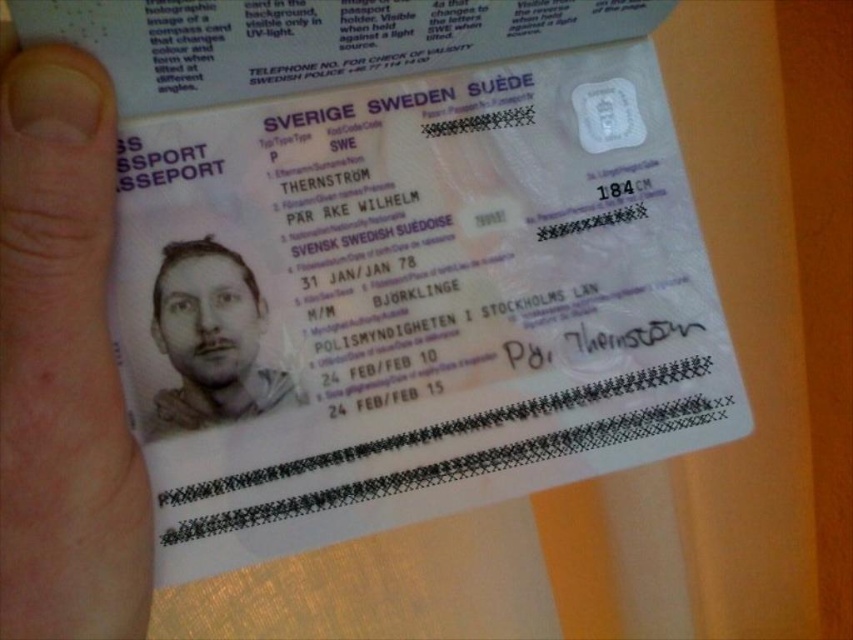
Question: Can you confirm if skin at upper left is smaller than gray matte portrait at center?

Choices:
 (A) yes
 (B) no

Answer: (B)

Question: Can you confirm if skin at upper left is thinner than gray matte portrait at center?

Choices:
 (A) yes
 (B) no

Answer: (A)

Question: Does skin at upper left appear on the left side of gray matte portrait at center?

Choices:
 (A) yes
 (B) no

Answer: (A)

Question: Which object is closer to the camera taking this photo?

Choices:
 (A) gray matte portrait at center
 (B) skin at upper left

Answer: (B)